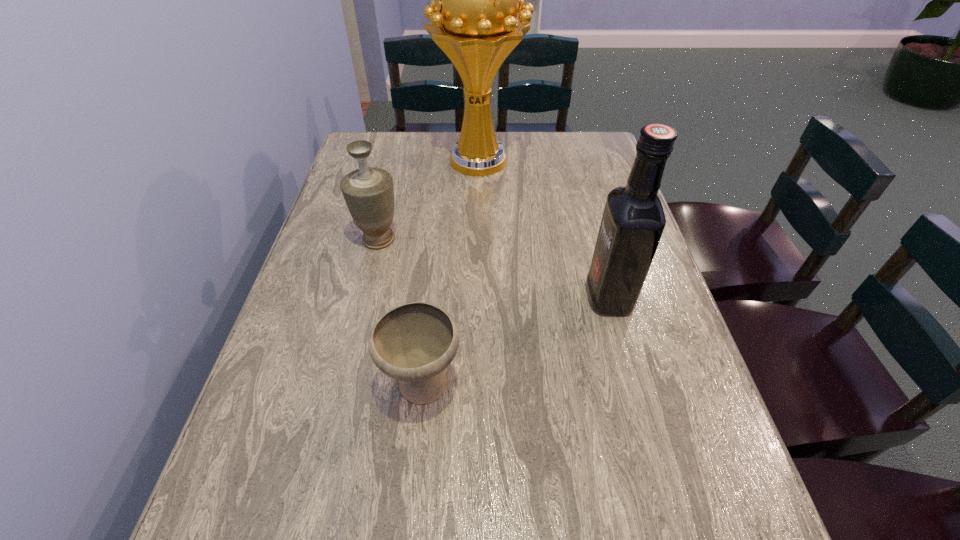
Find the location of a particular element. This screenshot has height=540, width=960. free space located on the front-facing side of the liquor is located at coordinates [x=414, y=296].

Locate an element on the screen. vacant space located on the front-facing side of the liquor is located at coordinates (542, 296).

Where is `free space located 0.080m on the back of the urn`? This screenshot has height=540, width=960. free space located 0.080m on the back of the urn is located at coordinates (387, 206).

The width and height of the screenshot is (960, 540). Find the location of `free space located on the left of the nearest object`. free space located on the left of the nearest object is located at coordinates (356, 385).

Locate an element on the screen. object at the far edge is located at coordinates (475, 0).

I want to click on object present at the left edge, so click(x=368, y=192).

This screenshot has width=960, height=540. What are the coordinates of `object located at the right edge` in the screenshot? It's located at (633, 220).

At what (x,y) coordinates should I click in order to perform the action: click on blank space at the far edge of the desktop. Please return your answer as a coordinate pair (x, y). Looking at the image, I should click on click(x=455, y=140).

Image resolution: width=960 pixels, height=540 pixels. In order to click on free space at the left edge of the desktop in this screenshot , I will do `click(314, 257)`.

Find the location of a particular element. The height and width of the screenshot is (540, 960). free space at the right edge of the desktop is located at coordinates (588, 199).